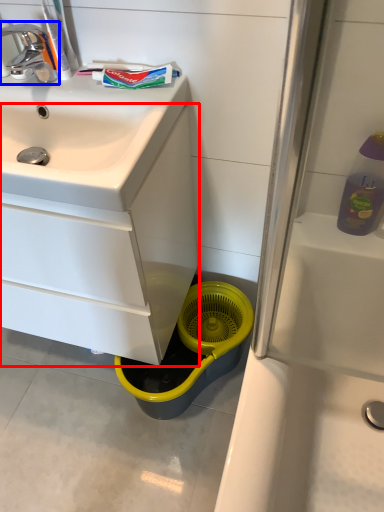
Question: Which object appears closest to the camera in this image, bathroom cabinet (highlighted by a red box) or tap (highlighted by a blue box)?

Choices:
 (A) bathroom cabinet
 (B) tap

Answer: (A)